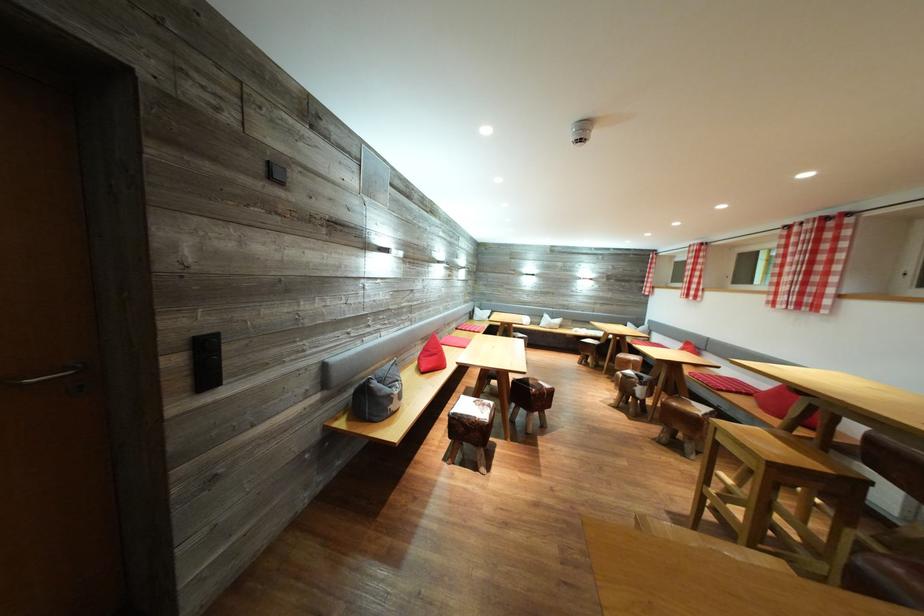
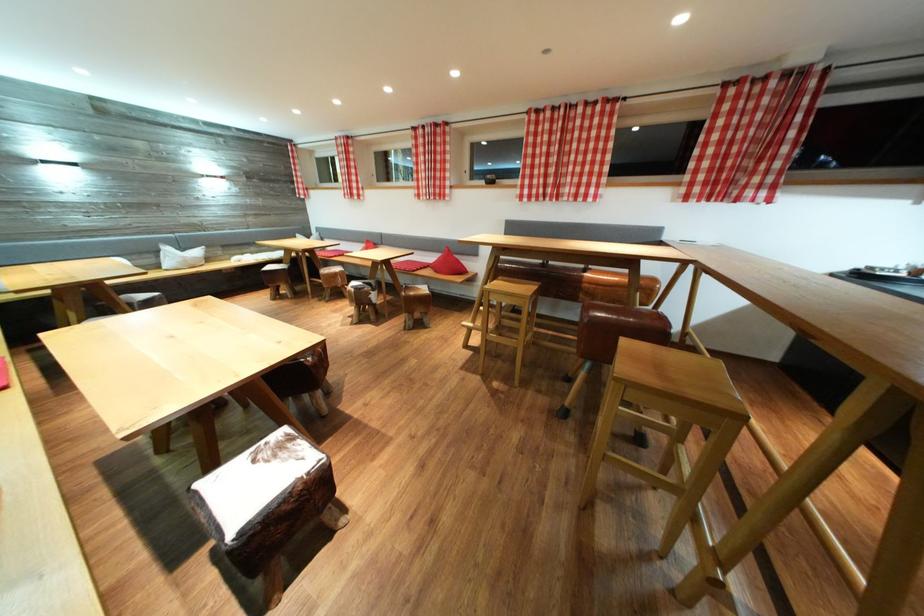
Find the pixel in the second image that matches [768,390] in the first image.

(438, 262)